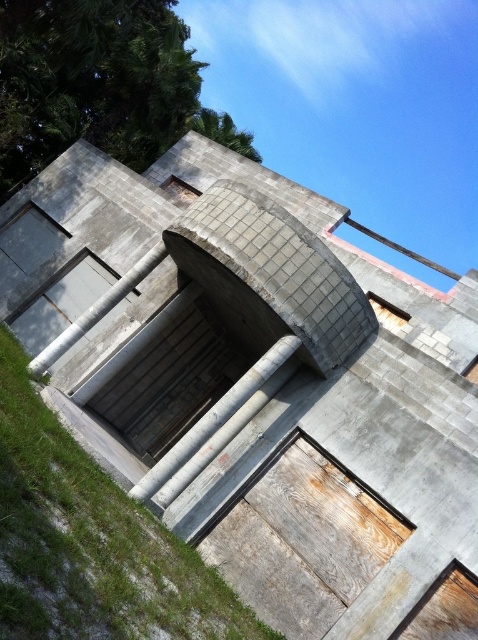
Is wooden door at center further to the viewer compared to concrete/wooden at center?

No, wooden door at center is in front of concrete/wooden at center.

Which of these two, wooden door at center or concrete/wooden at center, stands shorter?

wooden door at center

Which is in front, point (71, 566) or point (165, 465)?

Point (71, 566) is in front.

Locate an element on the screen. The height and width of the screenshot is (640, 478). wooden door at center is located at coordinates (90, 541).